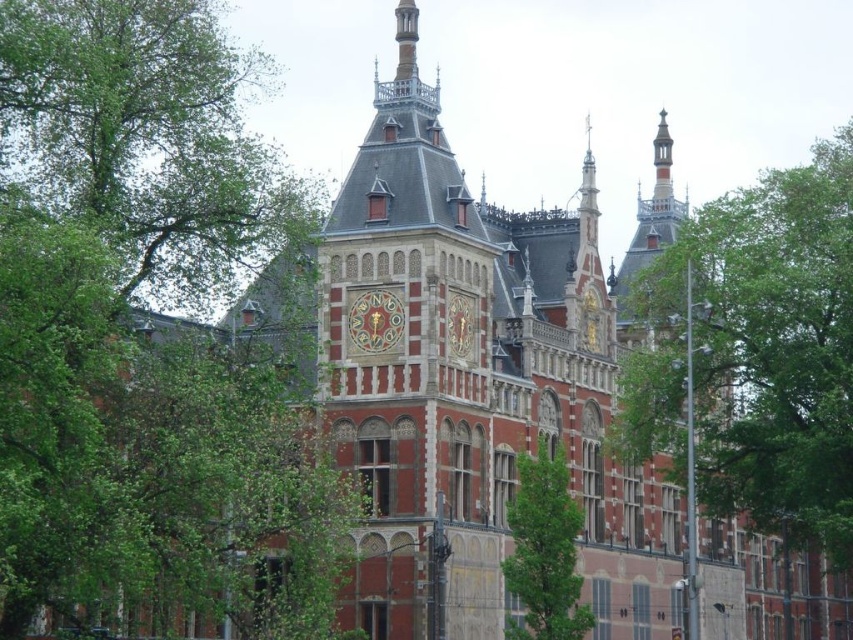
Consider the image. Who is positioned more to the right, green leafy tree at right or green leafy tree at lower right?

green leafy tree at right

Does green leafy tree at right appear under green leafy tree at lower right?

No.

Image resolution: width=853 pixels, height=640 pixels. Describe the element at coordinates (757, 353) in the screenshot. I see `green leafy tree at right` at that location.

At what (x,y) coordinates should I click in order to perform the action: click on green leafy tree at right. Please return your answer as a coordinate pair (x, y). Image resolution: width=853 pixels, height=640 pixels. Looking at the image, I should click on (757, 353).

Which is in front, point (113, 221) or point (726, 412)?

Point (113, 221)

Between point (35, 100) and point (828, 557), which one is positioned behind?

The point (828, 557) is more distant.

I want to click on green leafy tree at upper left, so click(x=148, y=140).

Between green leafy tree at upper left and green leafy tree at lower right, which one has more height?

green leafy tree at upper left

What do you see at coordinates (148, 140) in the screenshot? This screenshot has width=853, height=640. I see `green leafy tree at upper left` at bounding box center [148, 140].

Where is `green leafy tree at upper left`? This screenshot has height=640, width=853. green leafy tree at upper left is located at coordinates (148, 140).